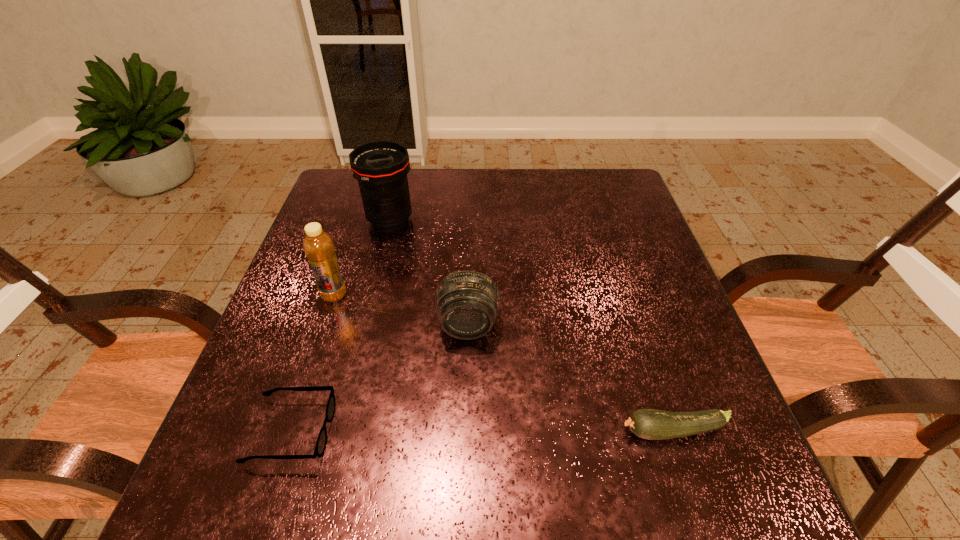
Select which object is the third closest to the bottle. Please provide its 2D coordinates. Your answer should be formatted as a tuple, i.e. [(x, y)], where the tuple contains the x and y coordinates of a point satisfying the conditions above.

[(320, 447)]